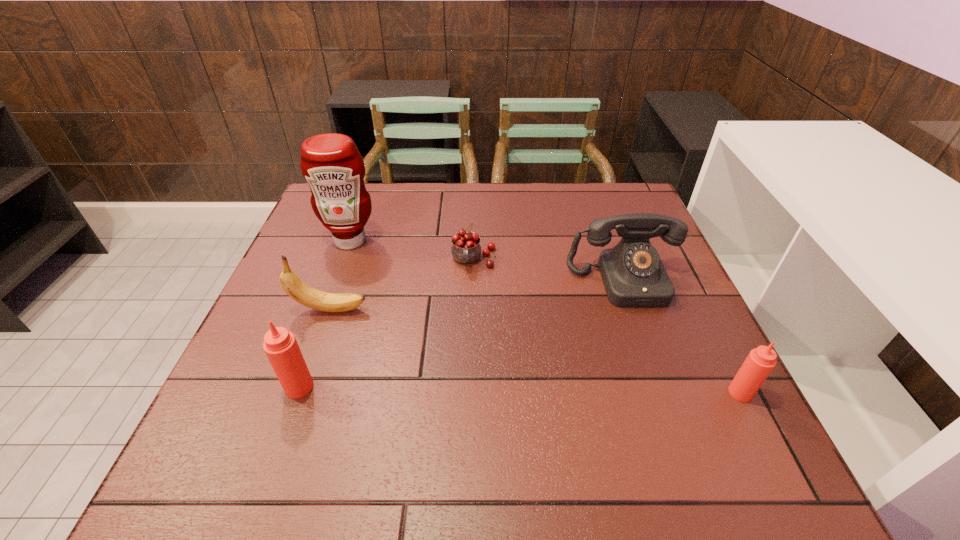
Where is `vacant area at the far edge of the desktop`? The image size is (960, 540). vacant area at the far edge of the desktop is located at coordinates (479, 217).

Find the location of a particular element. Image resolution: width=960 pixels, height=540 pixels. vacant region at the near edge of the desktop is located at coordinates (531, 399).

Where is `vacant point at the left edge`? The width and height of the screenshot is (960, 540). vacant point at the left edge is located at coordinates (338, 271).

At what (x,y) coordinates should I click in order to perform the action: click on vacant space at the right edge of the desktop. Please return your answer as a coordinate pair (x, y). This screenshot has height=540, width=960. Looking at the image, I should click on (703, 349).

In order to click on vacant space at the far right corner of the desktop in this screenshot , I will do `click(626, 192)`.

Find the location of `vacant space that's between the tallest object and the shortest object`. vacant space that's between the tallest object and the shortest object is located at coordinates (412, 251).

Find the location of a particular element. The image size is (960, 540). empty space that is in between the left Tabasco sauce and the banana is located at coordinates (315, 348).

Find the location of `vacant space that is in between the banana and the cherry`. vacant space that is in between the banana and the cherry is located at coordinates (402, 285).

The height and width of the screenshot is (540, 960). I want to click on blank region between the taller Tabasco sauce and the shortest object, so click(x=387, y=323).

Where is `unoccupied position between the taller Tabasco sauce and the shortest object`? The image size is (960, 540). unoccupied position between the taller Tabasco sauce and the shortest object is located at coordinates (387, 323).